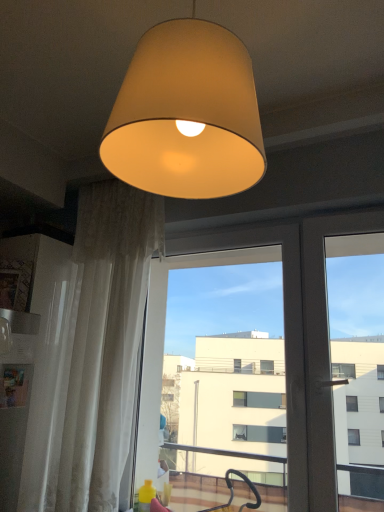
Question: In the image, is matte beige lampshade at upper center on the left side or the right side of white sheer curtain at left?

Choices:
 (A) left
 (B) right

Answer: (B)

Question: From their relative heights in the image, would you say matte beige lampshade at upper center is taller or shorter than white sheer curtain at left?

Choices:
 (A) tall
 (B) short

Answer: (B)

Question: Which of these objects is positioned farthest from the white sheer curtain at left?

Choices:
 (A) transparent glass screen door at center
 (B) matte beige lampshade at upper center

Answer: (B)

Question: Which of these objects is positioned farthest from the transparent glass screen door at center?

Choices:
 (A) white sheer curtain at left
 (B) matte beige lampshade at upper center

Answer: (B)